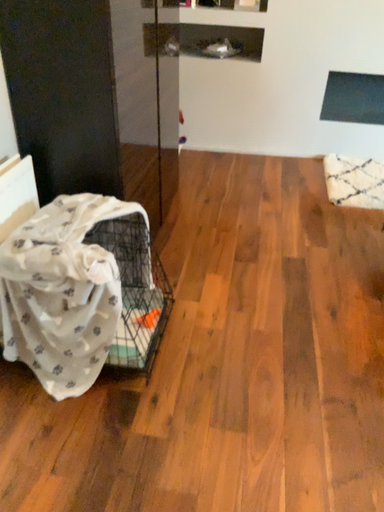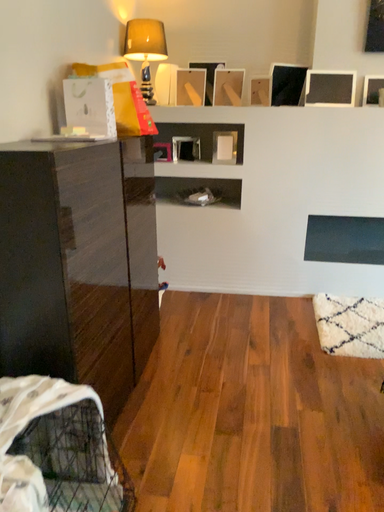
Question: How did the camera likely rotate when shooting the video?

Choices:
 (A) rotated downward
 (B) rotated upward

Answer: (B)